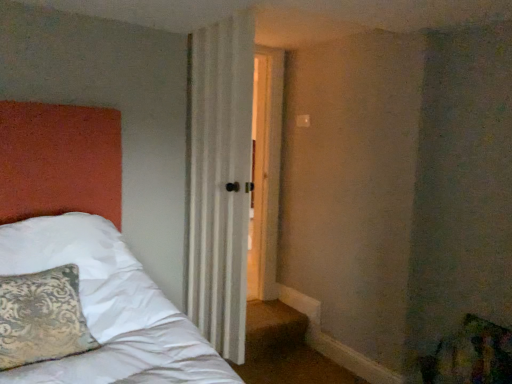
Question: Considering the relative positions of patterned fabric pillow at left and white sheer curtain at center in the image provided, is patterned fabric pillow at left to the left or to the right of white sheer curtain at center?

Choices:
 (A) right
 (B) left

Answer: (B)

Question: Is patterned fabric pillow at left taller or shorter than white sheer curtain at center?

Choices:
 (A) short
 (B) tall

Answer: (A)

Question: Considering the positions of patterned fabric pillow at left and white sheer curtain at center in the image, is patterned fabric pillow at left bigger or smaller than white sheer curtain at center?

Choices:
 (A) big
 (B) small

Answer: (B)

Question: Is white sheer curtain at center spatially inside patterned fabric pillow at left, or outside of it?

Choices:
 (A) outside
 (B) inside

Answer: (A)

Question: In terms of height, does white sheer curtain at center look taller or shorter compared to patterned fabric pillow at left?

Choices:
 (A) tall
 (B) short

Answer: (A)

Question: Is white sheer curtain at center wider or thinner than patterned fabric pillow at left?

Choices:
 (A) wide
 (B) thin

Answer: (B)

Question: From a real-world perspective, is white sheer curtain at center above or below patterned fabric pillow at left?

Choices:
 (A) below
 (B) above

Answer: (B)